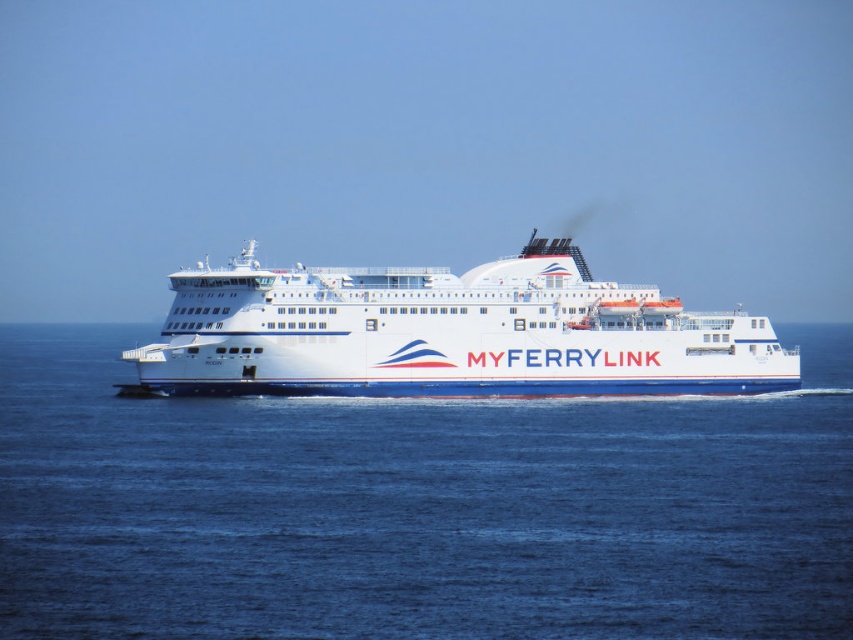
Question: Can you confirm if blue water at center is thinner than white glossy ferry at center?

Choices:
 (A) yes
 (B) no

Answer: (B)

Question: Which object is closer to the camera taking this photo?

Choices:
 (A) white glossy ferry at center
 (B) blue water at center

Answer: (B)

Question: Which point appears farthest from the camera in this image?

Choices:
 (A) (610, 308)
 (B) (633, 540)

Answer: (A)

Question: In this image, where is blue water at center located relative to white glossy ferry at center?

Choices:
 (A) below
 (B) above

Answer: (A)

Question: Is blue water at center closer to camera compared to white glossy ferry at center?

Choices:
 (A) yes
 (B) no

Answer: (A)